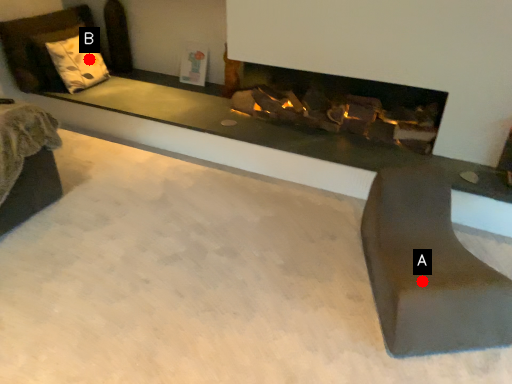
Question: Two points are circled on the image, labeled by A and B beside each circle. Which of the following is the closest to the observer?

Choices:
 (A) A is closer
 (B) B is closer

Answer: (A)